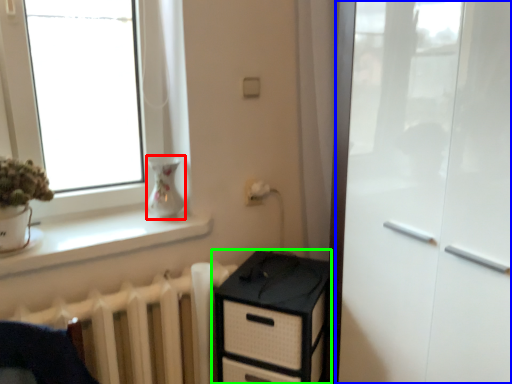
Question: Which object is the farthest from vase (highlighted by a red box)? Choose among these: screen door (highlighted by a blue box) or chest of drawers (highlighted by a green box).

Choices:
 (A) screen door
 (B) chest of drawers

Answer: (A)